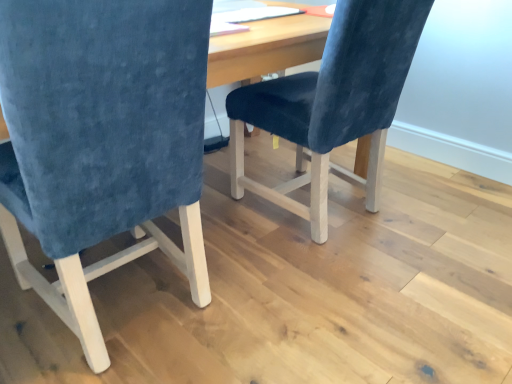
This screenshot has height=384, width=512. I want to click on free space to the right of velvet blue chair at left, which is the 1th chair in left-to-right order, so click(294, 308).